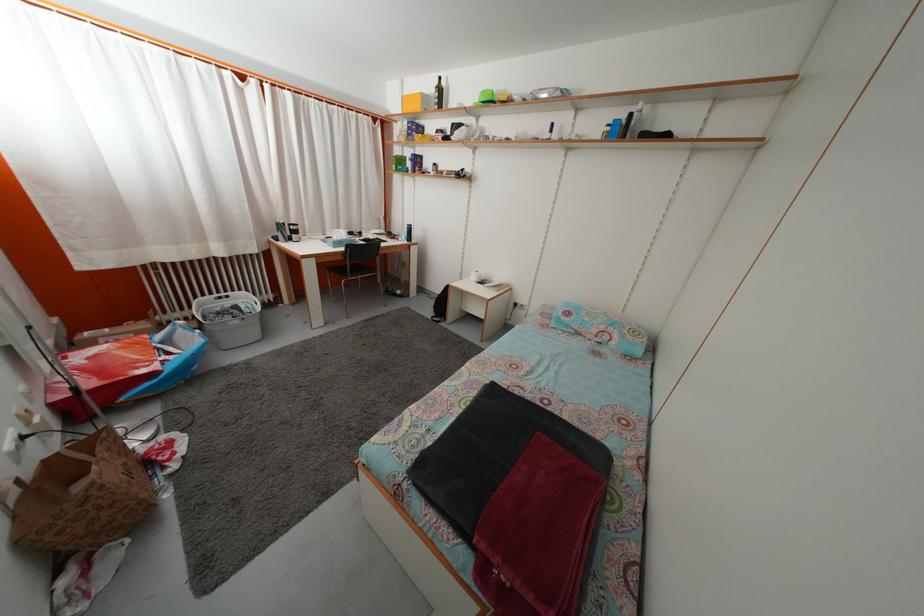
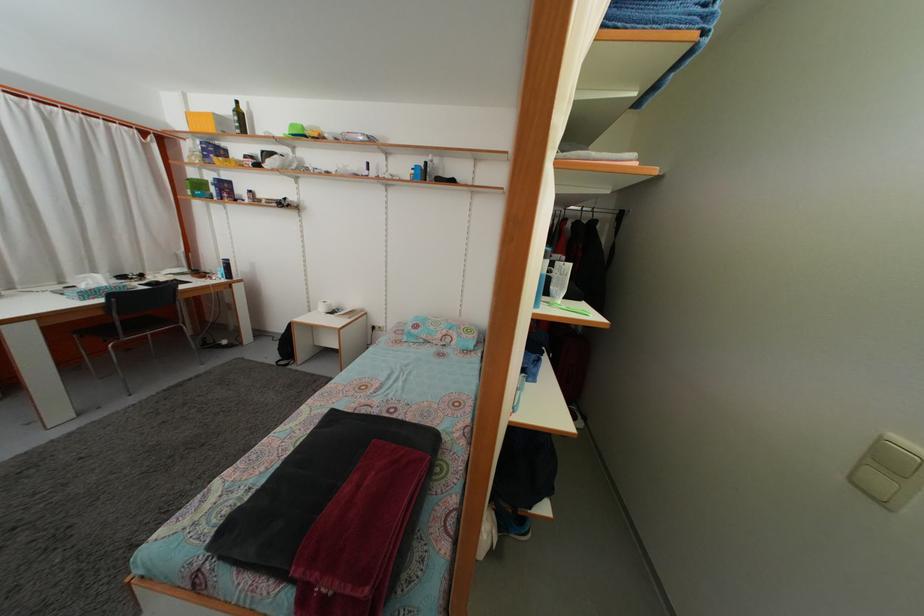
The point at (x=445, y=98) is marked in the first image. Where is the corresponding point in the second image?

(246, 122)